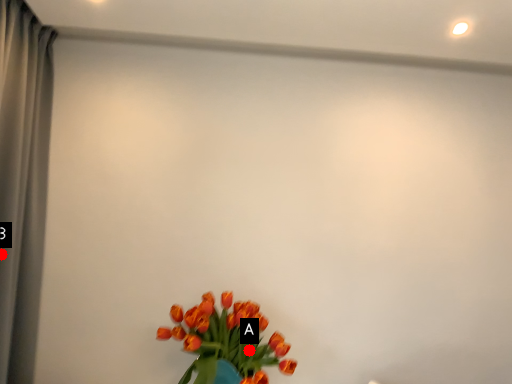
Question: Two points are circled on the image, labeled by A and B beside each circle. Among these points, which one is nearest to the camera?

Choices:
 (A) A is closer
 (B) B is closer

Answer: (B)